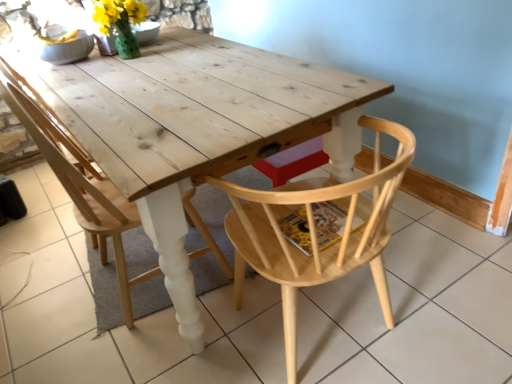
You are a GUI agent. You are given a task and a screenshot of the screen. Output one action in this format:
    pyautogui.click(x=<x>, y=<y>)
    Task: Click on the free spot in front of natural wood chair at center, which is counted as the 2th chair, starting from the right
    The image size is (512, 384).
    Given the screenshot: What is the action you would take?
    pyautogui.click(x=142, y=350)